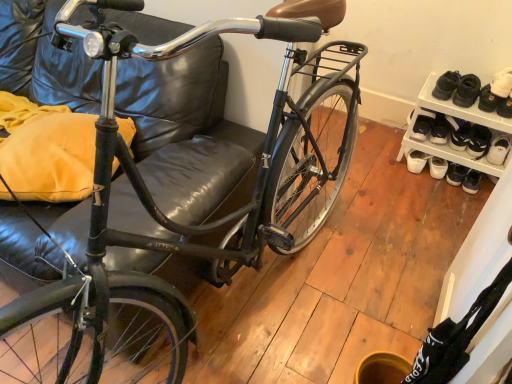
Describe the element at coordinates (478, 141) in the screenshot. The height and width of the screenshot is (384, 512). I see `white leather shoe at upper right, which is the second footwear in left-to-right order` at that location.

Find the location of a particular element. The image size is (512, 384). white mesh shoe rack at lower right is located at coordinates (457, 117).

Describe the element at coordinates (496, 91) in the screenshot. Image resolution: width=512 pixels, height=384 pixels. I see `white suede shoe at upper right` at that location.

Consider the image. What is the approximate height of white suede shoe at upper right?

white suede shoe at upper right is 4.41 inches tall.

This screenshot has width=512, height=384. Describe the element at coordinates (177, 222) in the screenshot. I see `shiny black bicycle at center` at that location.

Locate an element on the screen. white matte shoe at right, arranged as the first footwear when viewed from the left is located at coordinates (422, 125).

Is point (508, 127) closer or farther from the camera than point (110, 58)?

Point (508, 127) is positioned farther from the camera compared to point (110, 58).

Based on their positions, is white mesh shoe rack at lower right located to the left or right of shiny black bicycle at center?

Clearly, white mesh shoe rack at lower right is on the right of shiny black bicycle at center in the image.

Is white mesh shoe rack at lower right bigger than shiny black bicycle at center?

No.

Is white matte shoe at right, which is the second footwear in right-to-left order, facing away from white leather shoe at upper right, which is the second footwear in left-to-right order?

That's not correct — white matte shoe at right, which is the second footwear in right-to-left order, is not looking away from white leather shoe at upper right, which is the second footwear in left-to-right order.

Who is taller, white matte shoe at right, which is the second footwear in right-to-left order, or white leather shoe at upper right, which is the second footwear in left-to-right order?

Standing taller between the two is white leather shoe at upper right, which is the second footwear in left-to-right order.

Is white matte shoe at right, arranged as the first footwear when viewed from the left, positioned far away from white leather shoe at upper right, which is the second footwear in left-to-right order?

Actually, white matte shoe at right, arranged as the first footwear when viewed from the left, and white leather shoe at upper right, which is the second footwear in left-to-right order, are a little close together.

Which of these two, white matte shoe at right, which is the second footwear in right-to-left order, or white leather shoe at upper right, which is the second footwear in left-to-right order, is thinner?

white matte shoe at right, which is the second footwear in right-to-left order, is thinner.

Is point (503, 74) closer or farther from the camera than point (477, 136)?

Clearly, point (503, 74) is closer to the camera than point (477, 136).

Where is `footwear to the right of white suede shoe at upper right`? The width and height of the screenshot is (512, 384). footwear to the right of white suede shoe at upper right is located at coordinates (478, 141).

From the image's perspective, is white suede shoe at upper right positioned above or below white leather shoe at upper right, which is the second footwear in left-to-right order?

Based on their image positions, white suede shoe at upper right is located above white leather shoe at upper right, which is the second footwear in left-to-right order.

Are white suede shoe at upper right and white leather shoe at upper right, which is the second footwear in left-to-right order, located far from each other?

white suede shoe at upper right is actually quite close to white leather shoe at upper right, which is the second footwear in left-to-right order.

How many degrees apart are the facing directions of white matte shoe at right, which is the second footwear in right-to-left order, and shiny black bicycle at center?

The angle between the facing direction of white matte shoe at right, which is the second footwear in right-to-left order, and the facing direction of shiny black bicycle at center is 28 degrees.

From the picture: Is white matte shoe at right, which is the second footwear in right-to-left order, facing towards shiny black bicycle at center?

No, white matte shoe at right, which is the second footwear in right-to-left order, is not facing towards shiny black bicycle at center.

Can you see white matte shoe at right, arranged as the first footwear when viewed from the left, touching shiny black bicycle at center?

white matte shoe at right, arranged as the first footwear when viewed from the left, and shiny black bicycle at center are clearly separated.

From the image's perspective, is white matte shoe at right, which is the second footwear in right-to-left order, above or below shiny black bicycle at center?

Clearly, from the image's perspective, white matte shoe at right, which is the second footwear in right-to-left order, is above shiny black bicycle at center.

Based on the photo, between white leather shoe at upper right, which is the second footwear in left-to-right order, and white mesh shoe rack at lower right, which one appears on the right side from the viewer's perspective?

white leather shoe at upper right, which is the second footwear in left-to-right order.

Looking at their sizes, would you say white leather shoe at upper right, which is the second footwear in left-to-right order, is wider or thinner than white mesh shoe rack at lower right?

white leather shoe at upper right, which is the second footwear in left-to-right order, is thinner than white mesh shoe rack at lower right.

Is white leather shoe at upper right, which is the second footwear in left-to-right order, bigger or smaller than white mesh shoe rack at lower right?

white leather shoe at upper right, which is the second footwear in left-to-right order, is smaller than white mesh shoe rack at lower right.

Could you measure the distance between white leather shoe at upper right, which is the second footwear in left-to-right order, and white mesh shoe rack at lower right?

A distance of 5.91 inches exists between white leather shoe at upper right, which is the second footwear in left-to-right order, and white mesh shoe rack at lower right.

Does white suede shoe at upper right have a greater width compared to shiny black bicycle at center?

In fact, white suede shoe at upper right might be narrower than shiny black bicycle at center.

Is white suede shoe at upper right turned away from shiny black bicycle at center?

white suede shoe at upper right does not have its back to shiny black bicycle at center.

Does point (510, 75) lie behind point (66, 335)?

Yes, point (510, 75) is behind point (66, 335).

From a real-world perspective, which object rests below the other?

In real-world perspective, white suede shoe at upper right is lower.

From a real-world perspective, is white mesh shoe rack at lower right physically below white matte shoe at right, which is the second footwear in right-to-left order?

Yes, from a real-world perspective, white mesh shoe rack at lower right is beneath white matte shoe at right, which is the second footwear in right-to-left order.

Locate an element on the screen. This screenshot has height=384, width=512. shelf in front of the white matte shoe at right, which is the second footwear in right-to-left order is located at coordinates (457, 117).

Considering the positions of objects white mesh shoe rack at lower right and white matte shoe at right, arranged as the first footwear when viewed from the left, in the image provided, who is behind, white mesh shoe rack at lower right or white matte shoe at right, arranged as the first footwear when viewed from the left,?

white matte shoe at right, arranged as the first footwear when viewed from the left, is further from the camera.

Locate an element on the screen. The width and height of the screenshot is (512, 384). bicycle on the left of white mesh shoe rack at lower right is located at coordinates (177, 222).

I want to click on footwear to the right of white matte shoe at right, arranged as the first footwear when viewed from the left, so click(x=478, y=141).

Considering their positions, is white leather shoe at upper right, the first footwear from the right, positioned further to white suede shoe at upper right than shiny black bicycle at center?

shiny black bicycle at center is further to white suede shoe at upper right.

When comparing their distances from white suede shoe at upper right, does white mesh shoe rack at lower right or white leather shoe at upper right, which is the second footwear in left-to-right order, seem further?

white leather shoe at upper right, which is the second footwear in left-to-right order, is positioned further to the anchor white suede shoe at upper right.

Consider the image. Looking at the image, which one is located further to white leather shoe at upper right, which is the second footwear in left-to-right order, white mesh shoe rack at lower right or white suede shoe at upper right?

white suede shoe at upper right.

When comparing their distances from white leather shoe at upper right, the first footwear from the right, does white mesh shoe rack at lower right or shiny black bicycle at center seem further?

shiny black bicycle at center lies further to white leather shoe at upper right, the first footwear from the right, than the other object.

When comparing their distances from white matte shoe at right, arranged as the first footwear when viewed from the left, does white leather shoe at upper right, the first footwear from the right, or white mesh shoe rack at lower right seem closer?

Among the two, white mesh shoe rack at lower right is located nearer to white matte shoe at right, arranged as the first footwear when viewed from the left.

When comparing their distances from shiny black bicycle at center, does white mesh shoe rack at lower right or white matte shoe at right, which is the second footwear in right-to-left order, seem further?

white matte shoe at right, which is the second footwear in right-to-left order, is positioned further to the anchor shiny black bicycle at center.

Considering their positions, is white leather shoe at upper right, which is the second footwear in left-to-right order, positioned closer to shiny black bicycle at center than white suede shoe at upper right?

white suede shoe at upper right lies closer to shiny black bicycle at center than the other object.

Which object lies nearer to the anchor point white leather shoe at upper right, which is the second footwear in left-to-right order, shiny black bicycle at center or white mesh shoe rack at lower right?

The object closer to white leather shoe at upper right, which is the second footwear in left-to-right order, is white mesh shoe rack at lower right.

At what (x,y) coordinates should I click in order to perform the action: click on shoe between white matte shoe at right, which is the second footwear in right-to-left order, and white leather shoe at upper right, which is the second footwear in left-to-right order. Please return your answer as a coordinate pair (x, y). This screenshot has width=512, height=384. Looking at the image, I should click on (496, 91).

In order to click on shoe between shiny black bicycle at center and white leather shoe at upper right, the first footwear from the right, from front to back in this screenshot , I will do `click(496, 91)`.

The image size is (512, 384). I want to click on shelf located between shiny black bicycle at center and white matte shoe at right, which is the second footwear in right-to-left order, in the depth direction, so pyautogui.click(x=457, y=117).

The height and width of the screenshot is (384, 512). Find the location of `shelf between white suede shoe at upper right and white leather shoe at upper right, the first footwear from the right, from top to bottom`. shelf between white suede shoe at upper right and white leather shoe at upper right, the first footwear from the right, from top to bottom is located at coordinates (457, 117).